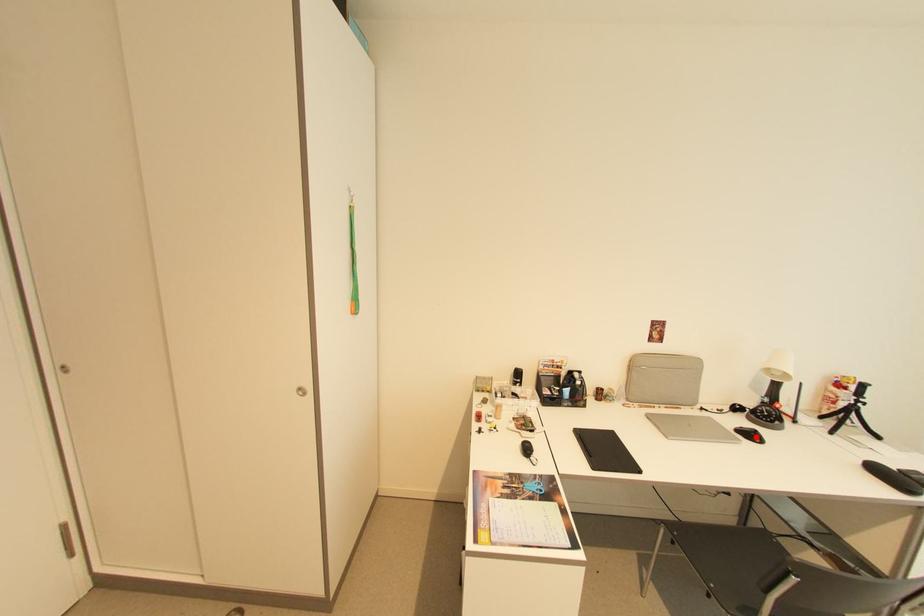
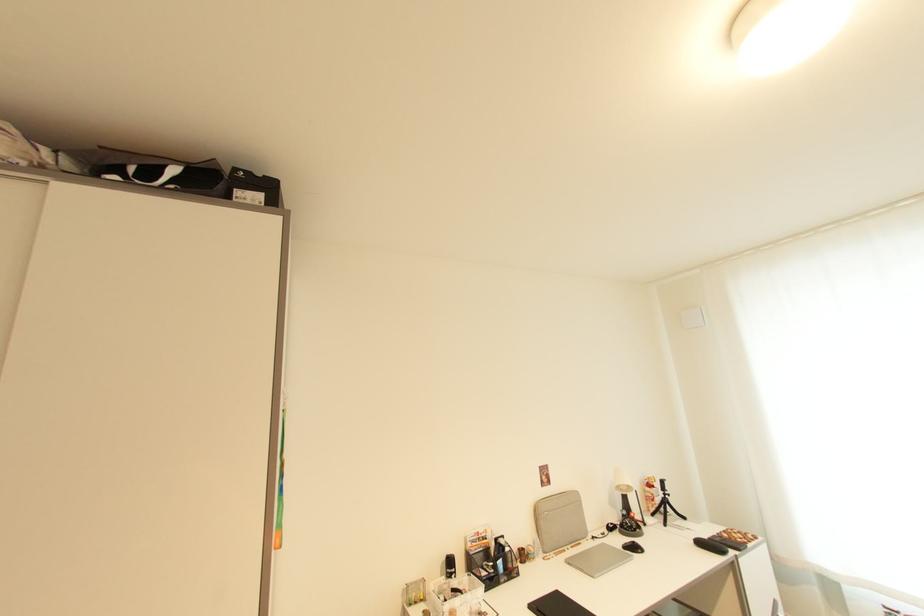
Where in the second image is the point corresponding to the highlighted location from the first image?

(639, 549)